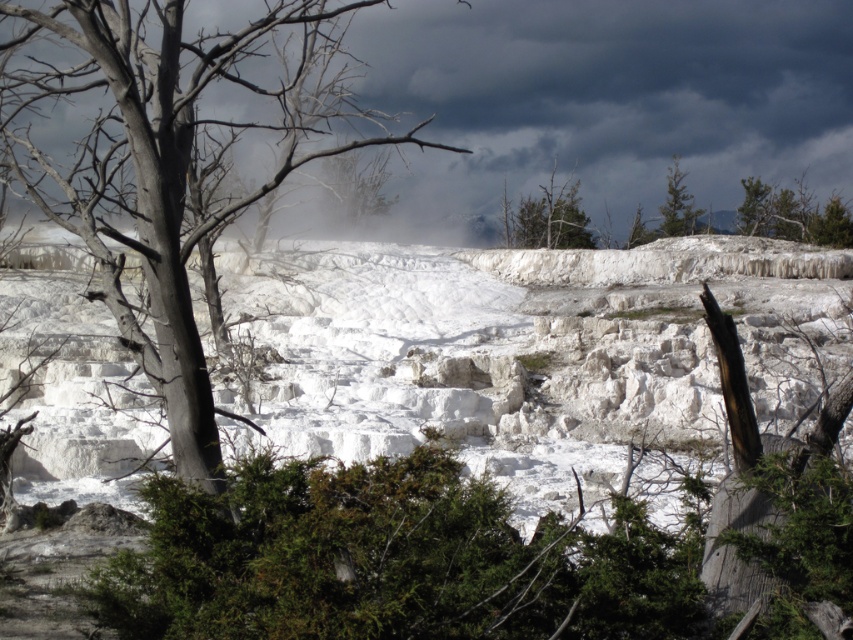
Question: Which object appears farthest from the camera in this image?

Choices:
 (A) green leafy tree at upper center
 (B) green textured pine at upper right
 (C) green matte tree at center

Answer: (B)

Question: Is gray bark tree at left below green textured pine at upper right?

Choices:
 (A) no
 (B) yes

Answer: (A)

Question: Considering the real-world distances, which object is closest to the green textured pine tree at upper right?

Choices:
 (A) green textured pine at upper right
 (B) white limestone terraces at center
 (C) green leafy tree at upper center

Answer: (A)

Question: Can you confirm if gray bark tree at left is positioned below green textured pine at upper right?

Choices:
 (A) yes
 (B) no

Answer: (B)

Question: Which object appears farthest from the camera in this image?

Choices:
 (A) green textured pine tree at upper right
 (B) green leafy tree at upper center
 (C) gray bark tree at left

Answer: (A)

Question: Is gray bark tree at left below green textured pine at upper right?

Choices:
 (A) no
 (B) yes

Answer: (A)